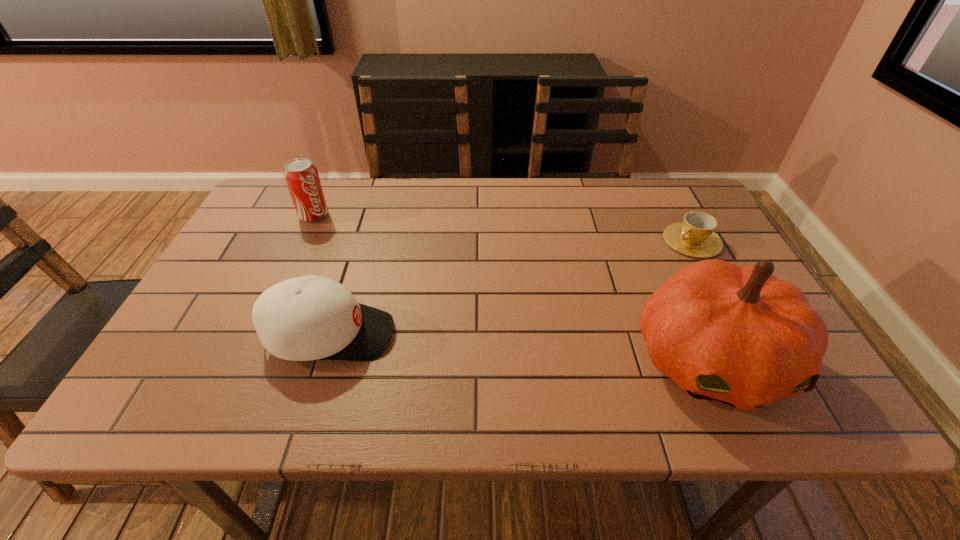
The height and width of the screenshot is (540, 960). Identify the location of vacant space located with the handle on the side of the shortest object. (650, 264).

You are a GUI agent. You are given a task and a screenshot of the screen. Output one action in this format:
    pyautogui.click(x=<x>, y=<y>)
    Task: Click on the soda can that is positioned at the far edge
    The image size is (960, 540).
    Given the screenshot: What is the action you would take?
    pyautogui.click(x=301, y=176)

You are a GUI agent. You are given a task and a screenshot of the screen. Output one action in this format:
    pyautogui.click(x=<x>, y=<y>)
    Task: Click on the cup located in the far edge section of the desktop
    
    Given the screenshot: What is the action you would take?
    point(695,236)

What are the coordinates of `baseball cap positioned at the near edge` in the screenshot? It's located at (306, 318).

Where is `pumpkin that is at the near edge`? The height and width of the screenshot is (540, 960). pumpkin that is at the near edge is located at coordinates (735, 334).

This screenshot has height=540, width=960. I want to click on object that is at the left edge, so click(x=301, y=176).

Find the location of a particular element. The width and height of the screenshot is (960, 540). pumpkin positioned at the right edge is located at coordinates (735, 334).

Where is `cup at the right edge`? The height and width of the screenshot is (540, 960). cup at the right edge is located at coordinates (695, 236).

Find the location of `object at the far left corner`. object at the far left corner is located at coordinates (301, 176).

Find the location of a particular element. Image resolution: width=960 pixels, height=540 pixels. object located in the far right corner section of the desktop is located at coordinates (695, 236).